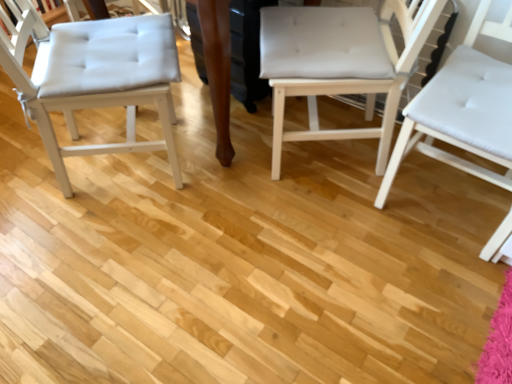
Locate an element on the screen. The height and width of the screenshot is (384, 512). white leather chair at right, placed as the 3th chair when sorted from left to right is located at coordinates (463, 109).

Describe the element at coordinates (463, 109) in the screenshot. This screenshot has width=512, height=384. I see `white leather chair at right, acting as the first chair starting from the right` at that location.

Identify the location of white tufted cushion at left, which is the 1th chair in left-to-right order. (93, 76).

Describe the element at coordinates (341, 63) in the screenshot. I see `white fabric chair at center, the second chair viewed from the left` at that location.

This screenshot has width=512, height=384. Identify the location of white leather chair at right, placed as the 3th chair when sorted from left to right. (463, 109).

From a real-world perspective, is white tufted cushion at left, which is the 1th chair in left-to-right order, positioned above or below white leather chair at right, acting as the first chair starting from the right?

white tufted cushion at left, which is the 1th chair in left-to-right order, is below white leather chair at right, acting as the first chair starting from the right.

Looking at this image, is white tufted cushion at left, which is the 1th chair in left-to-right order, bigger or smaller than white leather chair at right, acting as the first chair starting from the right?

In the image, white tufted cushion at left, which is the 1th chair in left-to-right order, appears to be larger than white leather chair at right, acting as the first chair starting from the right.

Which is in front, point (140, 79) or point (394, 172)?

The point (140, 79) is closer.

I want to click on the 1st chair above when counting from the white leather chair at right, acting as the first chair starting from the right (from the image's perspective), so click(93, 76).

How different are the orientations of white tufted cushion at left, arranged as the third chair when viewed from the right, and white fabric chair at center, the second chair viewed from the left, in degrees?

There is a 169-degree angle between the facing directions of white tufted cushion at left, arranged as the third chair when viewed from the right, and white fabric chair at center, the second chair viewed from the left.

From the image's perspective, is white tufted cushion at left, which is the 1th chair in left-to-right order, above white fabric chair at center, the second chair viewed from the left?

No, from the image's perspective, white tufted cushion at left, which is the 1th chair in left-to-right order, is not over white fabric chair at center, the second chair viewed from the left.

Locate an element on the screen. chair located above the white tufted cushion at left, arranged as the third chair when viewed from the right (from the image's perspective) is located at coordinates (341, 63).

Considering their positions, is white tufted cushion at left, which is the 1th chair in left-to-right order, located in front of or behind white fabric chair at center, the second chair viewed from the left?

white tufted cushion at left, which is the 1th chair in left-to-right order, is in front of white fabric chair at center, the second chair viewed from the left.

Would you consider white fabric chair at center, which appears as the second chair when viewed from the right, to be distant from white leather chair at right, acting as the first chair starting from the right?

No, white fabric chair at center, which appears as the second chair when viewed from the right, is not far from white leather chair at right, acting as the first chair starting from the right.

Does point (341, 35) appear closer or farther from the camera than point (472, 56)?

Point (341, 35) appears to be farther away from the viewer than point (472, 56).

Which of these two, white fabric chair at center, which appears as the second chair when viewed from the right, or white leather chair at right, acting as the first chair starting from the right, is smaller?

white fabric chair at center, which appears as the second chair when viewed from the right.

Which is behind, white fabric chair at center, the second chair viewed from the left, or white leather chair at right, placed as the 3th chair when sorted from left to right?

white fabric chair at center, the second chair viewed from the left, is further away from the camera.

Considering the relative positions of white fabric chair at center, the second chair viewed from the left, and white tufted cushion at left, arranged as the third chair when viewed from the right, in the image provided, is white fabric chair at center, the second chair viewed from the left, to the right of white tufted cushion at left, arranged as the third chair when viewed from the right, from the viewer's perspective?

Indeed, white fabric chair at center, the second chair viewed from the left, is positioned on the right side of white tufted cushion at left, arranged as the third chair when viewed from the right.

Is white fabric chair at center, which appears as the second chair when viewed from the right, facing towards white tufted cushion at left, arranged as the third chair when viewed from the right?

Yes, white fabric chair at center, which appears as the second chair when viewed from the right, is turned towards white tufted cushion at left, arranged as the third chair when viewed from the right.

From a real-world perspective, count 1st chairs upward from the white fabric chair at center, which appears as the second chair when viewed from the right, and point to it. Please provide its 2D coordinates.

[(93, 76)]

From the image's perspective, would you say white fabric chair at center, which appears as the second chair when viewed from the right, is shown under white tufted cushion at left, which is the 1th chair in left-to-right order?

Actually, white fabric chair at center, which appears as the second chair when viewed from the right, appears above white tufted cushion at left, which is the 1th chair in left-to-right order, in the image.

Which is closer to the camera, (443, 113) or (148, 17)?

Point (443, 113) is positioned closer to the camera compared to point (148, 17).

From the image's perspective, would you say white leather chair at right, acting as the first chair starting from the right, is shown under white tufted cushion at left, arranged as the third chair when viewed from the right?

Yes, from the image's perspective, white leather chair at right, acting as the first chair starting from the right, is beneath white tufted cushion at left, arranged as the third chair when viewed from the right.

What are the coordinates of `the 2nd chair to the left when counting from the white leather chair at right, acting as the first chair starting from the right` in the screenshot? It's located at (93, 76).

Looking at this image, in terms of width, does white leather chair at right, placed as the 3th chair when sorted from left to right, look wider or thinner when compared to white tufted cushion at left, arranged as the third chair when viewed from the right?

Considering their sizes, white leather chair at right, placed as the 3th chair when sorted from left to right, looks slimmer than white tufted cushion at left, arranged as the third chair when viewed from the right.

Which is more to the left, white leather chair at right, acting as the first chair starting from the right, or white fabric chair at center, the second chair viewed from the left?

white fabric chair at center, the second chair viewed from the left.

From a real-world perspective, is white leather chair at right, placed as the 3th chair when sorted from left to right, above or below white fabric chair at center, the second chair viewed from the left?

From a real-world perspective, white leather chair at right, placed as the 3th chair when sorted from left to right, is physically above white fabric chair at center, the second chair viewed from the left.

Between point (510, 71) and point (329, 81), which one is positioned in front?

The point (510, 71) is more forward.

How different are the orientations of white leather chair at right, acting as the first chair starting from the right, and white fabric chair at center, which appears as the second chair when viewed from the right, in degrees?

52.3 degrees separate the facing orientations of white leather chair at right, acting as the first chair starting from the right, and white fabric chair at center, which appears as the second chair when viewed from the right.

At what (x,y) coordinates should I click in order to perform the action: click on chair below the white tufted cushion at left, arranged as the third chair when viewed from the right (from the image's perspective). Please return your answer as a coordinate pair (x, y). The height and width of the screenshot is (384, 512). Looking at the image, I should click on (463, 109).

From the white tufted cushion at left, which is the 1th chair in left-to-right order, count 1st chair to the right and point to it. Please provide its 2D coordinates.

[(341, 63)]

Based on the photo, looking at the image, which one is located closer to white leather chair at right, placed as the 3th chair when sorted from left to right, white tufted cushion at left, which is the 1th chair in left-to-right order, or white fabric chair at center, the second chair viewed from the left?

The object closer to white leather chair at right, placed as the 3th chair when sorted from left to right, is white fabric chair at center, the second chair viewed from the left.

Estimate the real-world distances between objects in this image. Which object is further from white fabric chair at center, which appears as the second chair when viewed from the right, white tufted cushion at left, which is the 1th chair in left-to-right order, or white leather chair at right, acting as the first chair starting from the right?

Based on the image, white tufted cushion at left, which is the 1th chair in left-to-right order, appears to be further to white fabric chair at center, which appears as the second chair when viewed from the right.

In the scene shown: Looking at the image, which one is located closer to white leather chair at right, placed as the 3th chair when sorted from left to right, white fabric chair at center, the second chair viewed from the left, or white tufted cushion at left, arranged as the third chair when viewed from the right?

white fabric chair at center, the second chair viewed from the left, is closer to white leather chair at right, placed as the 3th chair when sorted from left to right.

Looking at the image, which one is located closer to white tufted cushion at left, which is the 1th chair in left-to-right order, white fabric chair at center, which appears as the second chair when viewed from the right, or white leather chair at right, acting as the first chair starting from the right?

white fabric chair at center, which appears as the second chair when viewed from the right, lies closer to white tufted cushion at left, which is the 1th chair in left-to-right order, than the other object.

Which object lies further to the anchor point white fabric chair at center, the second chair viewed from the left, white leather chair at right, placed as the 3th chair when sorted from left to right, or white tufted cushion at left, arranged as the third chair when viewed from the right?

white tufted cushion at left, arranged as the third chair when viewed from the right.

Looking at the image, which one is located further to white tufted cushion at left, which is the 1th chair in left-to-right order, white leather chair at right, acting as the first chair starting from the right, or white fabric chair at center, the second chair viewed from the left?

white leather chair at right, acting as the first chair starting from the right, is positioned further to the anchor white tufted cushion at left, which is the 1th chair in left-to-right order.

In order to click on chair between white tufted cushion at left, which is the 1th chair in left-to-right order, and white leather chair at right, acting as the first chair starting from the right, in the horizontal direction in this screenshot , I will do `click(341, 63)`.